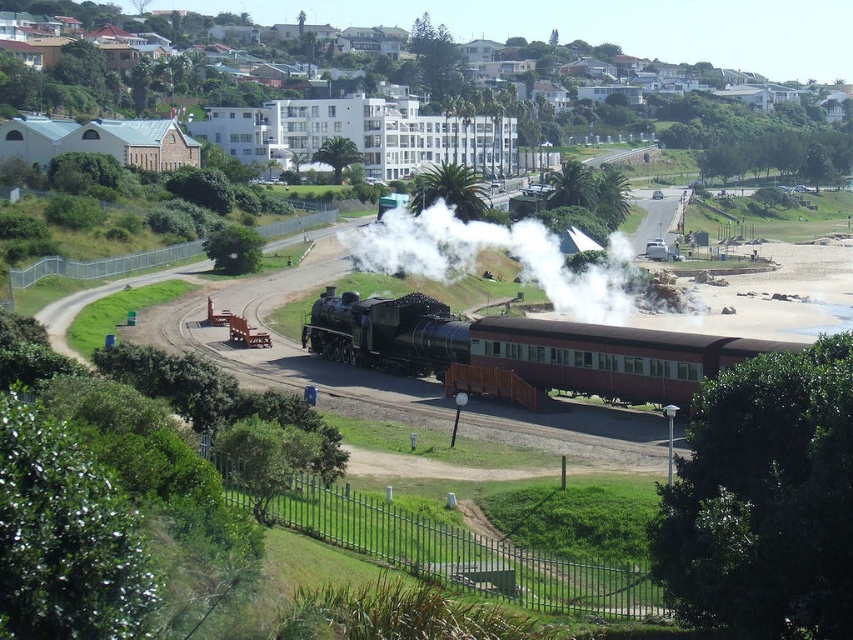
Question: Can you confirm if white smooth building at upper center is positioned to the right of matte black train at center?

Choices:
 (A) no
 (B) yes

Answer: (A)

Question: Among these objects, which one is nearest to the camera?

Choices:
 (A) white smooth building at upper center
 (B) matte black train at center

Answer: (B)

Question: Which is farther from the shiny black locomotive at center?

Choices:
 (A) white smoke at center
 (B) matte black train at center

Answer: (A)

Question: Which point is closer to the camera taking this photo?

Choices:
 (A) (415, 33)
 (B) (519, 237)
 (C) (402, 352)
 (D) (488, 374)

Answer: (D)

Question: Is white smooth building at upper center positioned before white smoke at center?

Choices:
 (A) no
 (B) yes

Answer: (A)

Question: From the image, what is the correct spatial relationship of white smooth building at upper center in relation to shiny black locomotive at center?

Choices:
 (A) left
 (B) right

Answer: (B)